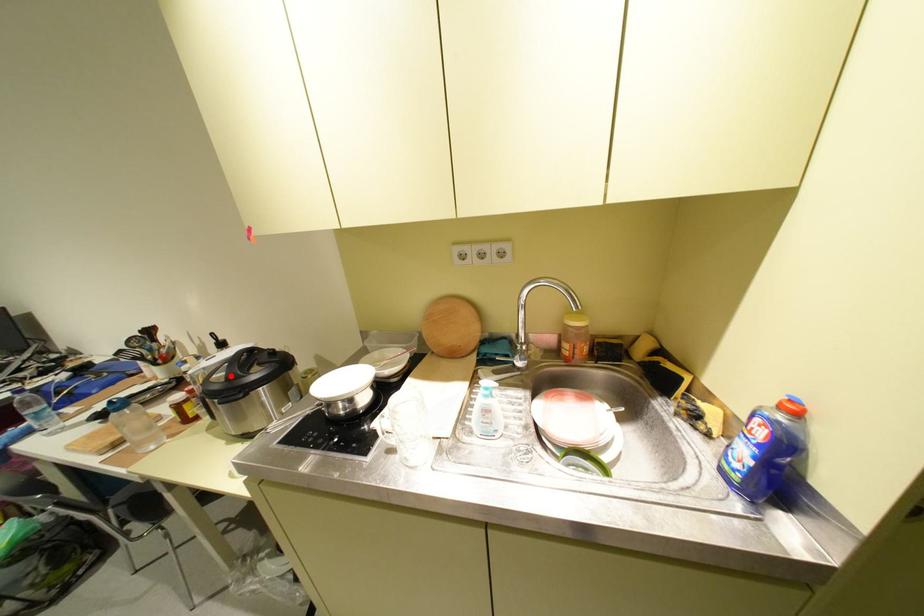
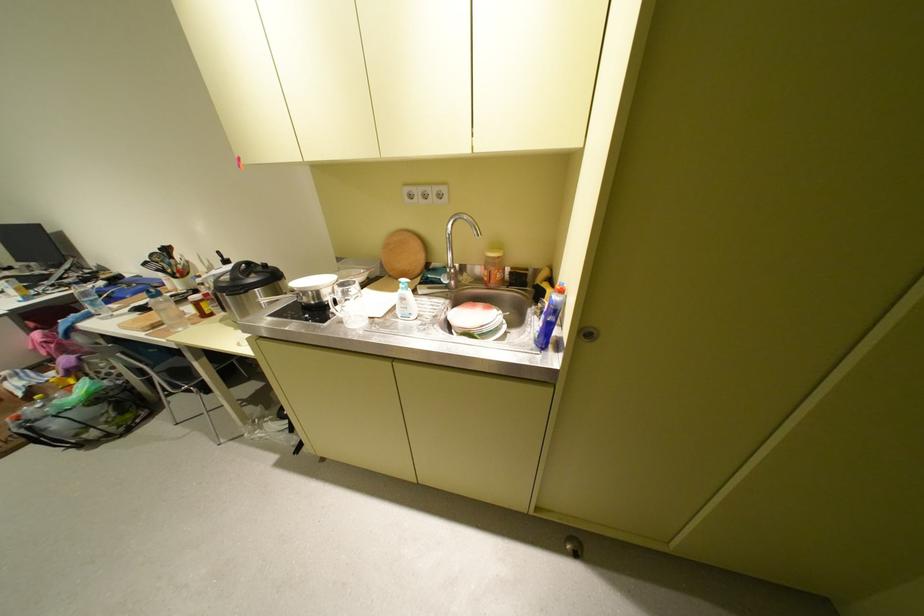
Where in the second image is the point corresponding to the highlighted location from the first image?

(237, 277)